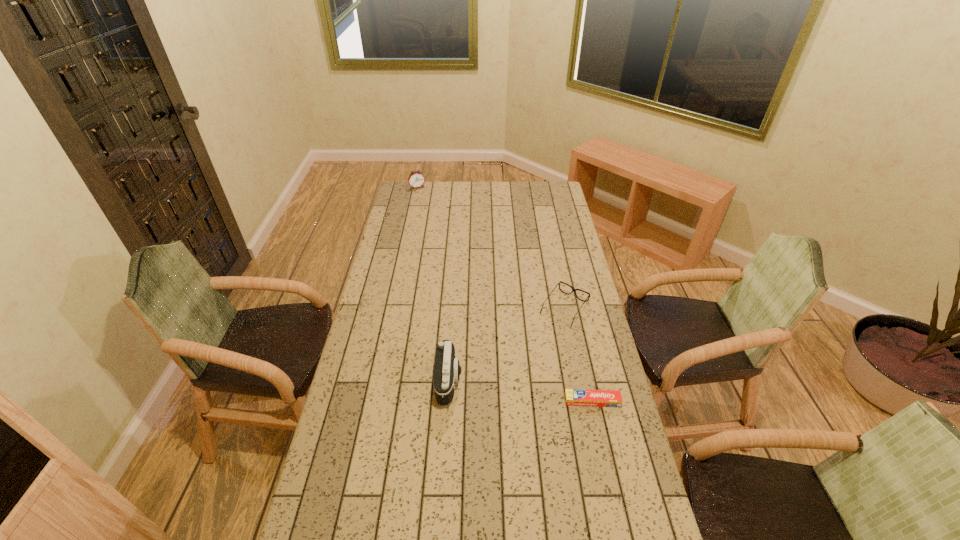
Locate an element on the screen. This screenshot has width=960, height=540. vacant region at the left edge of the desktop is located at coordinates (362, 396).

What are the coordinates of `free spot at the right edge of the desktop` in the screenshot? It's located at (557, 214).

You are a GUI agent. You are given a task and a screenshot of the screen. Output one action in this format:
    pyautogui.click(x=<x>, y=<y>)
    Task: Click on the blank space at the far right corner of the desktop
    This screenshot has width=960, height=540.
    Given the screenshot: What is the action you would take?
    pyautogui.click(x=558, y=200)

This screenshot has width=960, height=540. What are the coordinates of `free space between the second object from left to right and the toothpaste` in the screenshot? It's located at (520, 391).

You are a GUI agent. You are given a task and a screenshot of the screen. Output one action in this format:
    pyautogui.click(x=<x>, y=<y>)
    Task: Click on the unoccupied position between the third nearest object and the third shortest object
    The width and height of the screenshot is (960, 540).
    Given the screenshot: What is the action you would take?
    pyautogui.click(x=491, y=248)

Find the location of `vacant space in between the spectacles and the leftmost object`. vacant space in between the spectacles and the leftmost object is located at coordinates (491, 248).

The image size is (960, 540). Find the location of `free space between the camera and the toothpaste`. free space between the camera and the toothpaste is located at coordinates (520, 391).

Where is `free point between the leftmost object and the camera`? Image resolution: width=960 pixels, height=540 pixels. free point between the leftmost object and the camera is located at coordinates (433, 285).

Identify the location of free area in between the leftmost object and the camera. The width and height of the screenshot is (960, 540). (433, 285).

Identify the location of free spot between the farthest object and the camera. (433, 285).